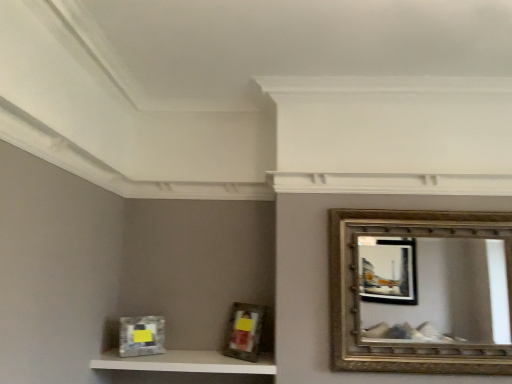
Where is `metallic silver picture frame at lower left, the second picture frame positioned from the right`? metallic silver picture frame at lower left, the second picture frame positioned from the right is located at coordinates (141, 336).

What is the approximate width of matte silver picture frame at center, marked as the first picture frame in a right-to-left arrangement?

matte silver picture frame at center, marked as the first picture frame in a right-to-left arrangement, is 7.57 inches wide.

The width and height of the screenshot is (512, 384). What do you see at coordinates (244, 331) in the screenshot?
I see `matte silver picture frame at center, marked as the first picture frame in a right-to-left arrangement` at bounding box center [244, 331].

What do you see at coordinates (434, 290) in the screenshot? I see `gold textured mirror at upper right` at bounding box center [434, 290].

Identify the location of gold textured mirror at upper right. Image resolution: width=512 pixels, height=384 pixels. (434, 290).

You are a GUI agent. You are given a task and a screenshot of the screen. Output one action in this format:
    pyautogui.click(x=<x>, y=<y>)
    Task: Click on the metallic silver picture frame at lower left, the second picture frame positioned from the right
    
    Given the screenshot: What is the action you would take?
    (x=141, y=336)

Is white textured shelf at lower left directly adjacent to gold textured mirror at upper right?

There is a gap between white textured shelf at lower left and gold textured mirror at upper right.

Is white textured shelf at lower left thinner than gold textured mirror at upper right?

In fact, white textured shelf at lower left might be wider than gold textured mirror at upper right.

Is white textured shelf at lower left facing towards gold textured mirror at upper right?

No, white textured shelf at lower left does not turn towards gold textured mirror at upper right.

Is point (90, 364) behind point (487, 259)?

That is False.

In the scene shown: Is metallic silver picture frame at lower left, the second picture frame positioned from the right, at the left side of matte silver picture frame at center, marked as the first picture frame in a right-to-left arrangement?

Yes.

Is metallic silver picture frame at lower left, the first picture frame from the left, oriented towards matte silver picture frame at center, marked as the first picture frame in a right-to-left arrangement?

No.

Does metallic silver picture frame at lower left, the first picture frame from the left, touch matte silver picture frame at center, placed as the second picture frame when sorted from left to right?

No, metallic silver picture frame at lower left, the first picture frame from the left, is not with matte silver picture frame at center, placed as the second picture frame when sorted from left to right.

Where is `picture frame lying on the left of matte silver picture frame at center, placed as the second picture frame when sorted from left to right`? picture frame lying on the left of matte silver picture frame at center, placed as the second picture frame when sorted from left to right is located at coordinates (141, 336).

Is matte silver picture frame at center, marked as the first picture frame in a right-to-left arrangement, positioned behind metallic silver picture frame at lower left, the first picture frame from the left?

No, it is not.

From a real-world perspective, which object rests below the other?

metallic silver picture frame at lower left, the first picture frame from the left, is physically lower.

Are matte silver picture frame at center, placed as the second picture frame when sorted from left to right, and metallic silver picture frame at lower left, the second picture frame positioned from the right, beside each other?

matte silver picture frame at center, placed as the second picture frame when sorted from left to right, is not next to metallic silver picture frame at lower left, the second picture frame positioned from the right, and they're not touching.

Between matte silver picture frame at center, placed as the second picture frame when sorted from left to right, and metallic silver picture frame at lower left, the second picture frame positioned from the right, which one has larger size?

Bigger between the two is matte silver picture frame at center, placed as the second picture frame when sorted from left to right.

Considering the positions of points (206, 357) and (125, 349), is point (206, 357) closer to camera compared to point (125, 349)?

That is True.

Is there a large distance between white textured shelf at lower left and metallic silver picture frame at lower left, the first picture frame from the left?

white textured shelf at lower left is near metallic silver picture frame at lower left, the first picture frame from the left, not far away.

From the image's perspective, is white textured shelf at lower left located beneath metallic silver picture frame at lower left, the first picture frame from the left?

Yes, from the image's perspective, white textured shelf at lower left is below metallic silver picture frame at lower left, the first picture frame from the left.

From a real-world perspective, which object rests below the other?

From a 3D spatial view, white textured shelf at lower left is below.

From the image's perspective, which is below, white textured shelf at lower left or matte silver picture frame at center, marked as the first picture frame in a right-to-left arrangement?

white textured shelf at lower left appears lower in the image.

Considering the relative positions of white textured shelf at lower left and matte silver picture frame at center, placed as the second picture frame when sorted from left to right, in the image provided, is white textured shelf at lower left to the left of matte silver picture frame at center, placed as the second picture frame when sorted from left to right, from the viewer's perspective?

Indeed, white textured shelf at lower left is positioned on the left side of matte silver picture frame at center, placed as the second picture frame when sorted from left to right.

Between white textured shelf at lower left and matte silver picture frame at center, placed as the second picture frame when sorted from left to right, which one has more height?

matte silver picture frame at center, placed as the second picture frame when sorted from left to right.

Find the location of a particular element. The image size is (512, 384). the 2nd picture frame directly above the white textured shelf at lower left (from a real-world perspective) is located at coordinates (244, 331).

Does matte silver picture frame at center, placed as the second picture frame when sorted from left to right, have a lesser height compared to white textured shelf at lower left?

No, matte silver picture frame at center, placed as the second picture frame when sorted from left to right, is not shorter than white textured shelf at lower left.

How distant is matte silver picture frame at center, marked as the first picture frame in a right-to-left arrangement, from white textured shelf at lower left?

matte silver picture frame at center, marked as the first picture frame in a right-to-left arrangement, is 26.02 centimeters away from white textured shelf at lower left.

Is matte silver picture frame at center, placed as the second picture frame when sorted from left to right, outside of white textured shelf at lower left?

Indeed, matte silver picture frame at center, placed as the second picture frame when sorted from left to right, is completely outside white textured shelf at lower left.

Is matte silver picture frame at center, marked as the first picture frame in a right-to-left arrangement, further to the viewer compared to white textured shelf at lower left?

Yes, it is behind white textured shelf at lower left.

Considering the sizes of objects metallic silver picture frame at lower left, the second picture frame positioned from the right, and gold textured mirror at upper right in the image provided, who is wider, metallic silver picture frame at lower left, the second picture frame positioned from the right, or gold textured mirror at upper right?

metallic silver picture frame at lower left, the second picture frame positioned from the right.

Looking at this image, from the image's perspective, is metallic silver picture frame at lower left, the second picture frame positioned from the right, on gold textured mirror at upper right?

No, from the image's perspective, metallic silver picture frame at lower left, the second picture frame positioned from the right, is not on top of gold textured mirror at upper right.

Can you confirm if metallic silver picture frame at lower left, the second picture frame positioned from the right, is positioned to the left of gold textured mirror at upper right?

Yes.

Identify the location of shelf below the gold textured mirror at upper right (from the image's perspective). (186, 363).

What are the coordinates of `picture frame on the right side of metallic silver picture frame at lower left, the second picture frame positioned from the right` in the screenshot? It's located at (244, 331).

Looking at this image, when comparing their distances from metallic silver picture frame at lower left, the second picture frame positioned from the right, does white textured shelf at lower left or matte silver picture frame at center, placed as the second picture frame when sorted from left to right, seem closer?

Based on the image, white textured shelf at lower left appears to be nearer to metallic silver picture frame at lower left, the second picture frame positioned from the right.

Considering their positions, is white textured shelf at lower left positioned further to matte silver picture frame at center, marked as the first picture frame in a right-to-left arrangement, than gold textured mirror at upper right?

A: gold textured mirror at upper right is positioned further to the anchor matte silver picture frame at center, marked as the first picture frame in a right-to-left arrangement.

Based on their spatial positions, is matte silver picture frame at center, marked as the first picture frame in a right-to-left arrangement, or white textured shelf at lower left further from metallic silver picture frame at lower left, the second picture frame positioned from the right?

matte silver picture frame at center, marked as the first picture frame in a right-to-left arrangement, is positioned further to the anchor metallic silver picture frame at lower left, the second picture frame positioned from the right.

Based on their spatial positions, is white textured shelf at lower left or gold textured mirror at upper right further from metallic silver picture frame at lower left, the second picture frame positioned from the right?

The object further to metallic silver picture frame at lower left, the second picture frame positioned from the right, is gold textured mirror at upper right.

Considering their positions, is gold textured mirror at upper right positioned further to metallic silver picture frame at lower left, the second picture frame positioned from the right, than matte silver picture frame at center, marked as the first picture frame in a right-to-left arrangement?

gold textured mirror at upper right is positioned further to the anchor metallic silver picture frame at lower left, the second picture frame positioned from the right.

Based on the photo, when comparing their distances from metallic silver picture frame at lower left, the first picture frame from the left, does gold textured mirror at upper right or white textured shelf at lower left seem closer?

white textured shelf at lower left is closer to metallic silver picture frame at lower left, the first picture frame from the left.

Estimate the real-world distances between objects in this image. Which object is closer to metallic silver picture frame at lower left, the first picture frame from the left, matte silver picture frame at center, placed as the second picture frame when sorted from left to right, or gold textured mirror at upper right?

matte silver picture frame at center, placed as the second picture frame when sorted from left to right, is positioned closer to the anchor metallic silver picture frame at lower left, the first picture frame from the left.

Based on their spatial positions, is metallic silver picture frame at lower left, the second picture frame positioned from the right, or gold textured mirror at upper right further from matte silver picture frame at center, marked as the first picture frame in a right-to-left arrangement?

The object further to matte silver picture frame at center, marked as the first picture frame in a right-to-left arrangement, is gold textured mirror at upper right.

I want to click on shelf located between metallic silver picture frame at lower left, the first picture frame from the left, and matte silver picture frame at center, marked as the first picture frame in a right-to-left arrangement, in the left-right direction, so click(186, 363).

You are a GUI agent. You are given a task and a screenshot of the screen. Output one action in this format:
    pyautogui.click(x=<x>, y=<y>)
    Task: Click on the picture frame located between metallic silver picture frame at lower left, the second picture frame positioned from the right, and gold textured mirror at upper right in the left-right direction
    
    Given the screenshot: What is the action you would take?
    pyautogui.click(x=244, y=331)

You are a GUI agent. You are given a task and a screenshot of the screen. Output one action in this format:
    pyautogui.click(x=<x>, y=<y>)
    Task: Click on the picture frame between white textured shelf at lower left and gold textured mirror at upper right from left to right
    
    Given the screenshot: What is the action you would take?
    pyautogui.click(x=244, y=331)

Identify the location of shelf between metallic silver picture frame at lower left, the second picture frame positioned from the right, and gold textured mirror at upper right, in the horizontal direction. (186, 363).